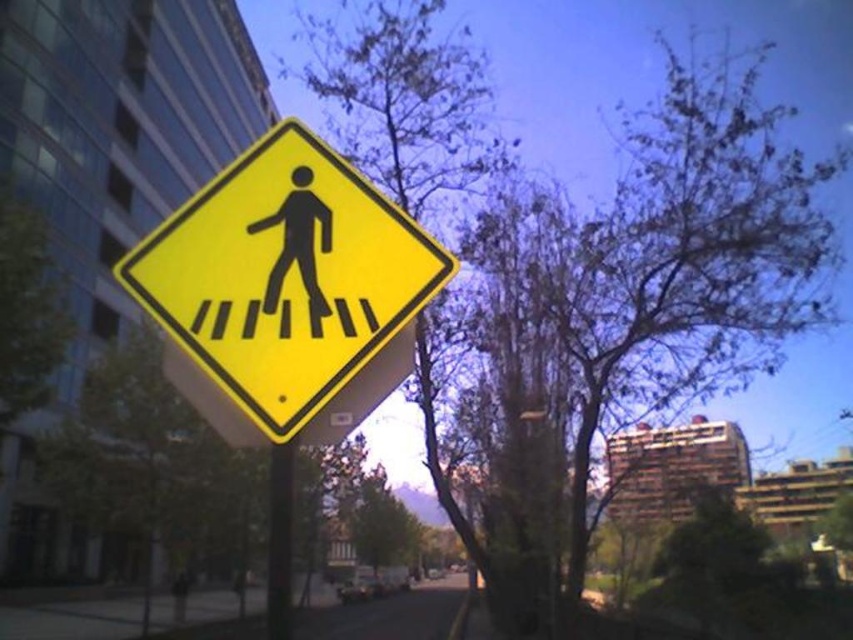
Which is in front, point (320, 397) or point (323, 304)?

Positioned in front is point (320, 397).

Does yellow matte pedestrian crossing sign at center appear over black silhouette at center?

No, yellow matte pedestrian crossing sign at center is not above black silhouette at center.

The image size is (853, 640). Find the location of `yellow matte pedestrian crossing sign at center`. yellow matte pedestrian crossing sign at center is located at coordinates (286, 292).

Does black silhouette at center have a lesser height compared to black plastic pole at center?

Yes, black silhouette at center is shorter than black plastic pole at center.

Who is positioned more to the left, black silhouette at center or black plastic pole at center?

black plastic pole at center

The width and height of the screenshot is (853, 640). Describe the element at coordinates (299, 244) in the screenshot. I see `black silhouette at center` at that location.

Locate an element on the screen. black silhouette at center is located at coordinates (299, 244).

Who is positioned more to the left, yellow matte pedestrian crossing sign at center or black plastic pole at center?

black plastic pole at center

Is point (225, 392) less distant than point (270, 531)?

Yes, point (225, 392) is closer to viewer.

Locate an element on the screen. yellow matte pedestrian crossing sign at center is located at coordinates (286, 292).

In order to click on yellow matte pedestrian crossing sign at center in this screenshot , I will do `click(286, 292)`.